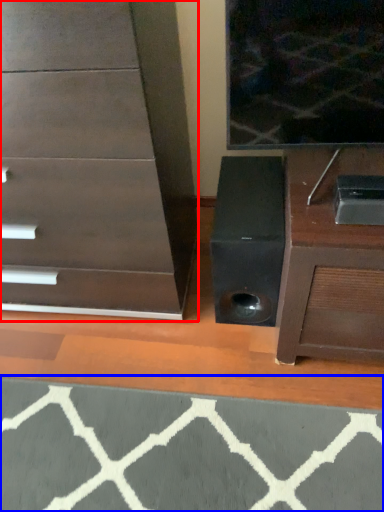
Question: Which object is closer to the camera taking this photo, chest of drawers (highlighted by a red box) or doormat (highlighted by a blue box)?

Choices:
 (A) chest of drawers
 (B) doormat

Answer: (A)